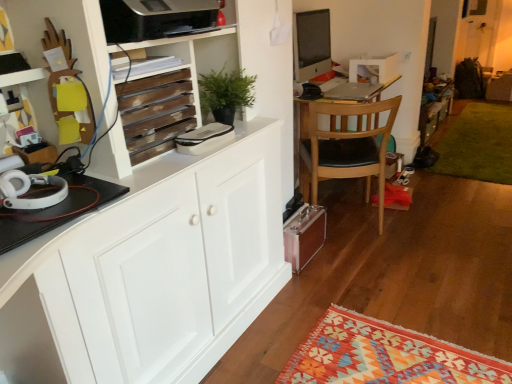
Question: From a real-world perspective, is silver metallic laptop at center on top of wooden slats at upper left?

Choices:
 (A) yes
 (B) no

Answer: (B)

Question: Does silver metallic laptop at center have a greater height compared to wooden slats at upper left?

Choices:
 (A) yes
 (B) no

Answer: (B)

Question: Does silver metallic laptop at center have a lesser width compared to wooden slats at upper left?

Choices:
 (A) no
 (B) yes

Answer: (A)

Question: From a real-world perspective, is silver metallic laptop at center located beneath wooden slats at upper left?

Choices:
 (A) yes
 (B) no

Answer: (A)

Question: Is silver metallic laptop at center shorter than wooden slats at upper left?

Choices:
 (A) no
 (B) yes

Answer: (B)

Question: From the image's perspective, is silver metallic laptop at center located beneath wooden slats at upper left?

Choices:
 (A) yes
 (B) no

Answer: (B)

Question: Is satin black monitor at upper center outside wooden slats at upper left?

Choices:
 (A) yes
 (B) no

Answer: (A)

Question: Does satin black monitor at upper center have a greater height compared to wooden slats at upper left?

Choices:
 (A) yes
 (B) no

Answer: (A)

Question: From the image's perspective, is satin black monitor at upper center over wooden slats at upper left?

Choices:
 (A) yes
 (B) no

Answer: (A)

Question: Does satin black monitor at upper center have a smaller size compared to wooden slats at upper left?

Choices:
 (A) no
 (B) yes

Answer: (A)

Question: Is satin black monitor at upper center looking in the opposite direction of wooden slats at upper left?

Choices:
 (A) no
 (B) yes

Answer: (A)

Question: Can you confirm if satin black monitor at upper center is thinner than wooden slats at upper left?

Choices:
 (A) yes
 (B) no

Answer: (A)

Question: Would you consider light brown wood chair at center to be distant from satin black monitor at upper center?

Choices:
 (A) yes
 (B) no

Answer: (B)